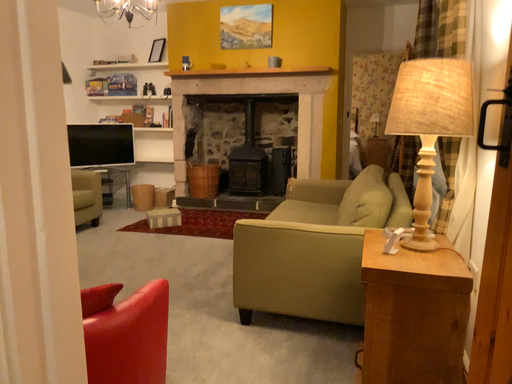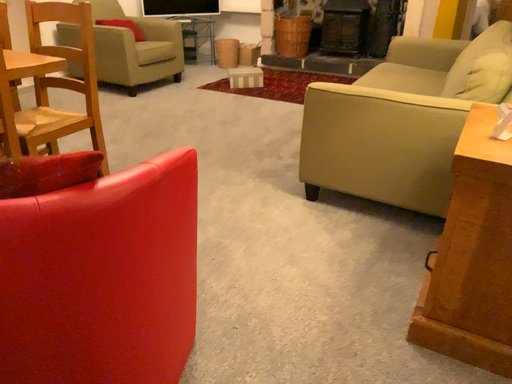
Question: Which way did the camera rotate in the video?

Choices:
 (A) rotated upward
 (B) rotated downward

Answer: (B)